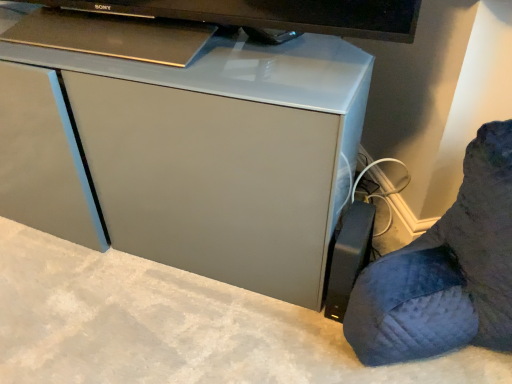
Question: From their relative heights in the image, would you say black plastic power strip at lower right is taller or shorter than matte gray cabinet at center?

Choices:
 (A) short
 (B) tall

Answer: (A)

Question: In terms of width, does black plastic power strip at lower right look wider or thinner when compared to matte gray cabinet at center?

Choices:
 (A) thin
 (B) wide

Answer: (B)

Question: From the image's perspective, is black plastic power strip at lower right positioned above or below matte gray cabinet at center?

Choices:
 (A) below
 (B) above

Answer: (A)

Question: From a real-world perspective, is matte gray cabinet at center above or below black plastic power strip at lower right?

Choices:
 (A) below
 (B) above

Answer: (B)

Question: In the image, is matte gray cabinet at center positioned in front of or behind black plastic power strip at lower right?

Choices:
 (A) behind
 (B) front

Answer: (A)

Question: Visually, is matte gray cabinet at center positioned to the left or to the right of black plastic power strip at lower right?

Choices:
 (A) right
 (B) left

Answer: (B)

Question: Is matte gray cabinet at center inside or outside of black plastic power strip at lower right?

Choices:
 (A) inside
 (B) outside

Answer: (B)